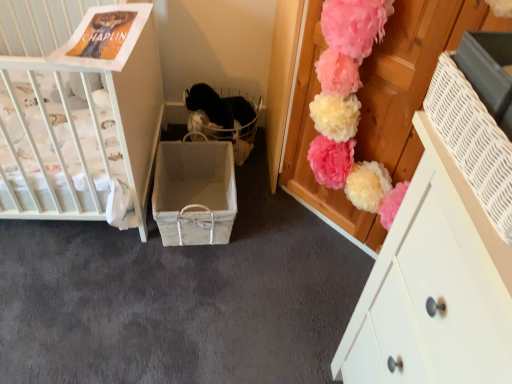
This screenshot has height=384, width=512. I want to click on free space in front of white wicker crib at left, so click(x=79, y=301).